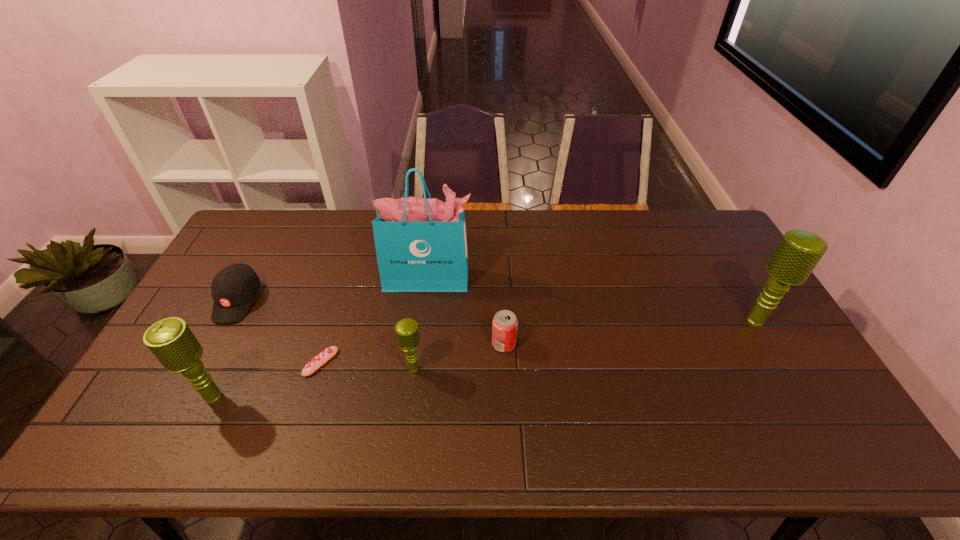
To make them evenly spaced by inserting another microphone among them, please locate a vacant spot for this new microphone. Please provide its 2D coordinates. Your answer should be formatted as a tuple, i.e. [(x, y)], where the tuple contains the x and y coordinates of a point satisfying the conditions above.

[(593, 344)]